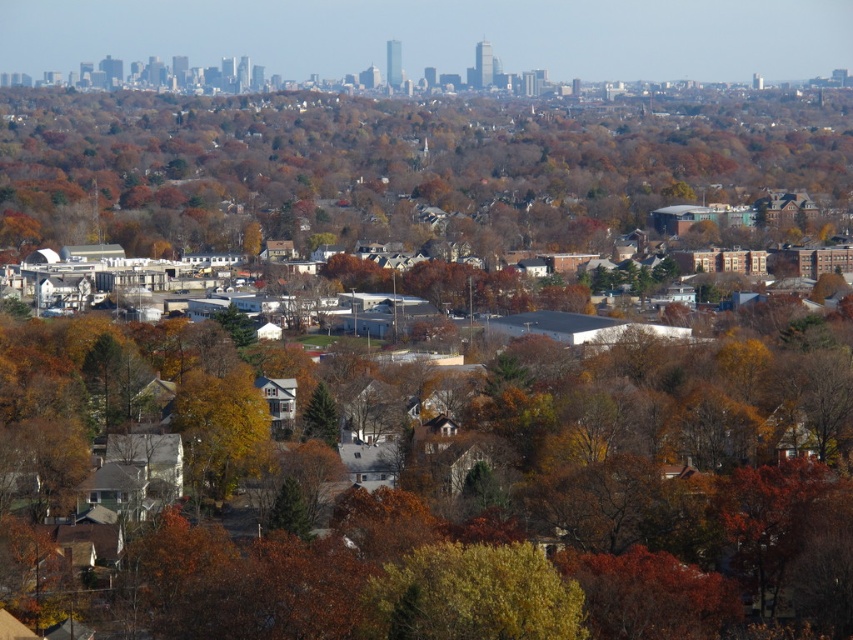
You are standing at point [474,595] in the suburban area. What object is located exactly at your current position?

The yellow green leafy tree at center is located exactly at point [474,595].